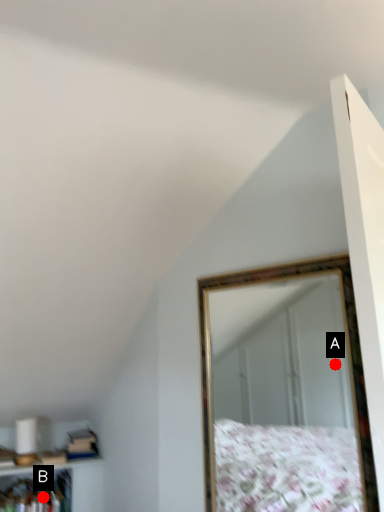
Question: Two points are circled on the image, labeled by A and B beside each circle. Which of the following is the farthest from the observer?

Choices:
 (A) A is further
 (B) B is further

Answer: (A)